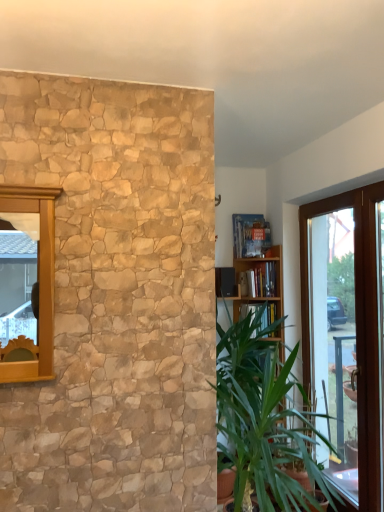
Question: Would you consider hardcover book at center, the 2th book from the top, to be distant from green leafy plant at right?

Choices:
 (A) no
 (B) yes

Answer: (A)

Question: Is hardcover book at center, the first book from the bottom, oriented away from green leafy plant at right?

Choices:
 (A) no
 (B) yes

Answer: (A)

Question: Does hardcover book at center, the 2th book from the top, have a smaller size compared to green leafy plant at right?

Choices:
 (A) no
 (B) yes

Answer: (B)

Question: Can you confirm if hardcover book at center, the first book from the bottom, is positioned to the left of green leafy plant at right?

Choices:
 (A) yes
 (B) no

Answer: (B)

Question: Can you see hardcover book at center, the 2th book from the top, touching green leafy plant at right?

Choices:
 (A) no
 (B) yes

Answer: (A)

Question: Is green leafy plant at right inside or outside of transparent glass door at right?

Choices:
 (A) inside
 (B) outside

Answer: (B)

Question: In the image, is green leafy plant at right on the left side or the right side of transparent glass door at right?

Choices:
 (A) left
 (B) right

Answer: (A)

Question: From the image's perspective, is green leafy plant at right located above or below transparent glass door at right?

Choices:
 (A) below
 (B) above

Answer: (A)

Question: Is green leafy plant at right bigger or smaller than transparent glass door at right?

Choices:
 (A) big
 (B) small

Answer: (A)

Question: Considering the positions of point (372, 507) and point (276, 321), is point (372, 507) closer or farther from the camera than point (276, 321)?

Choices:
 (A) closer
 (B) farther

Answer: (A)

Question: Considering the relative positions of transparent glass door at right and green leafy plant at right in the image provided, is transparent glass door at right to the left or to the right of green leafy plant at right?

Choices:
 (A) left
 (B) right

Answer: (B)

Question: In terms of width, does transparent glass door at right look wider or thinner when compared to green leafy plant at right?

Choices:
 (A) thin
 (B) wide

Answer: (A)

Question: Considering their positions, is transparent glass door at right located in front of or behind green leafy plant at right?

Choices:
 (A) front
 (B) behind

Answer: (B)

Question: Looking at their shapes, would you say hardcover book at center, the 2th book from the top, is wider or thinner than hardcover book at upper center, the 1th book when ordered from top to bottom?

Choices:
 (A) thin
 (B) wide

Answer: (A)

Question: Visually, is hardcover book at center, the first book from the bottom, positioned to the left or to the right of hardcover book at upper center, placed as the second book when sorted from bottom to top?

Choices:
 (A) left
 (B) right

Answer: (B)